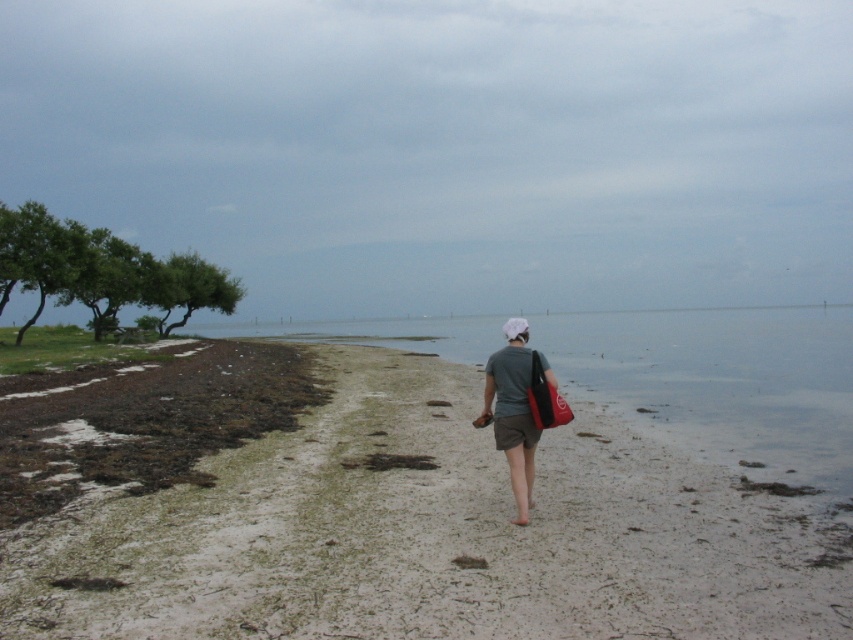
Does white sandy beach at center appear over clear water at lower left?

Incorrect, white sandy beach at center is not positioned above clear water at lower left.

Can you confirm if white sandy beach at center is smaller than clear water at lower left?

Yes.

You are a GUI agent. You are given a task and a screenshot of the screen. Output one action in this format:
    pyautogui.click(x=<x>, y=<y>)
    Task: Click on the white sandy beach at center
    Image resolution: width=853 pixels, height=640 pixels.
    Given the screenshot: What is the action you would take?
    pyautogui.click(x=426, y=534)

Which is more to the left, clear water at lower left or green leafy tree at left?

From the viewer's perspective, green leafy tree at left appears more on the left side.

Is clear water at lower left wider than green leafy tree at left?

Yes.

What do you see at coordinates (723, 380) in the screenshot? The height and width of the screenshot is (640, 853). I see `clear water at lower left` at bounding box center [723, 380].

Locate an element on the screen. This screenshot has width=853, height=640. clear water at lower left is located at coordinates (723, 380).

Can you confirm if green leafy trees at left is positioned below green leafy tree at left?

Incorrect, green leafy trees at left is not positioned below green leafy tree at left.

Can you confirm if green leafy trees at left is shorter than green leafy tree at left?

In fact, green leafy trees at left may be taller than green leafy tree at left.

What are the coordinates of `green leafy trees at left` in the screenshot? It's located at (102, 272).

Identify the location of green leafy trees at left. (102, 272).